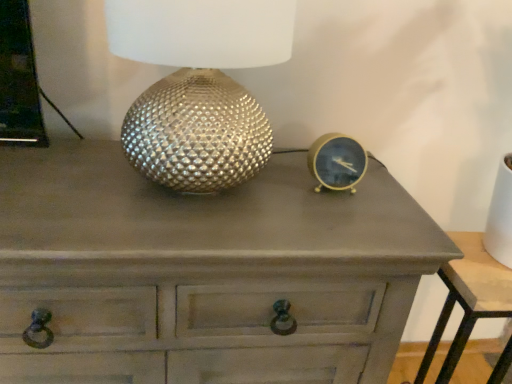
Question: Considering the positions of matte gray chest of drawers at center and matte gray nightstand at lower right in the image, is matte gray chest of drawers at center wider or thinner than matte gray nightstand at lower right?

Choices:
 (A) thin
 (B) wide

Answer: (B)

Question: From a real-world perspective, relative to matte gray nightstand at lower right, is matte gray chest of drawers at center vertically above or below?

Choices:
 (A) above
 (B) below

Answer: (A)

Question: Which is nearer to the matte gray nightstand at lower right?

Choices:
 (A) matte gray chest of drawers at center
 (B) gold metallic clock at right
 (C) metallic textured lamp at center

Answer: (B)

Question: Which is farther from the metallic textured lamp at center?

Choices:
 (A) matte gray chest of drawers at center
 (B) gold metallic clock at right
 (C) matte gray nightstand at lower right

Answer: (C)